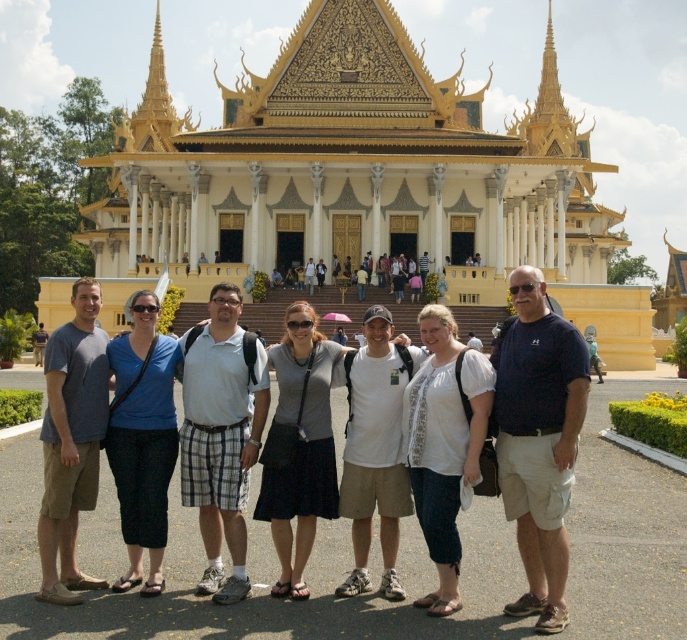
You are standing in front of the grand building and see two people wearing a white cotton shirt at center and a matte blue shirt at center. Which person is positioned to the right of the other?

The white cotton shirt at center is to the right of matte blue shirt at center.

You are a photographer standing 10 feet away from the group. You want to take a photo that includes both the white cotton shirt at center and the matte blue shirt at center. Considering their distance apart, will you need to zoom out your camera lens to capture both in the frame?

The white cotton shirt at center and the matte blue shirt at center are 54.04 feet apart. Since you are 10 feet away from the group, the distance between them is much larger than your distance from them. To include both in the frame, you will need to zoom out your camera lens to widen the field of view.